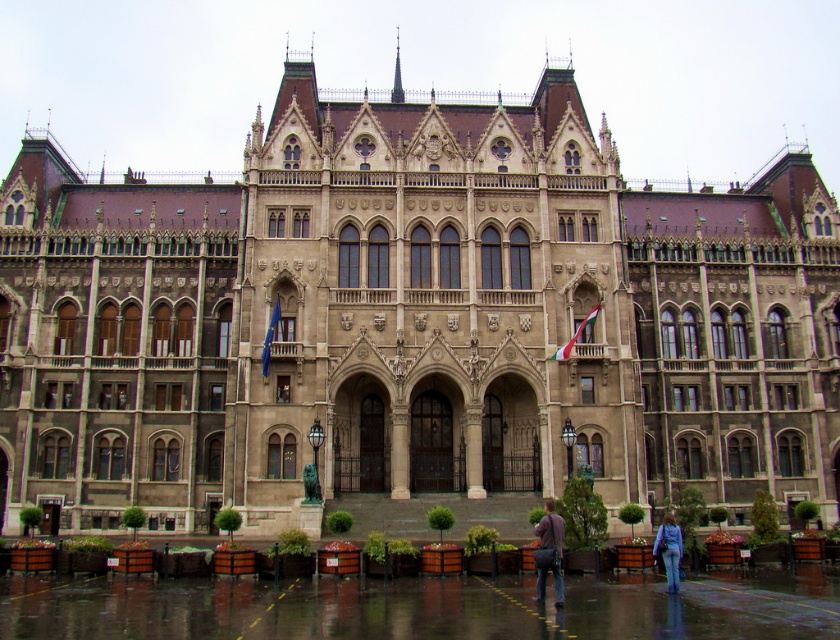
Is dark brown leather jacket at lower center closer to the viewer compared to purple fabric bag at lower right?

Yes, it is in front of purple fabric bag at lower right.

Is point (554, 529) positioned in front of point (667, 592)?

Yes, it is.

This screenshot has height=640, width=840. I want to click on dark brown leather jacket at lower center, so click(x=550, y=552).

Where is `dark brown leather jacket at lower center`? The image size is (840, 640). dark brown leather jacket at lower center is located at coordinates (550, 552).